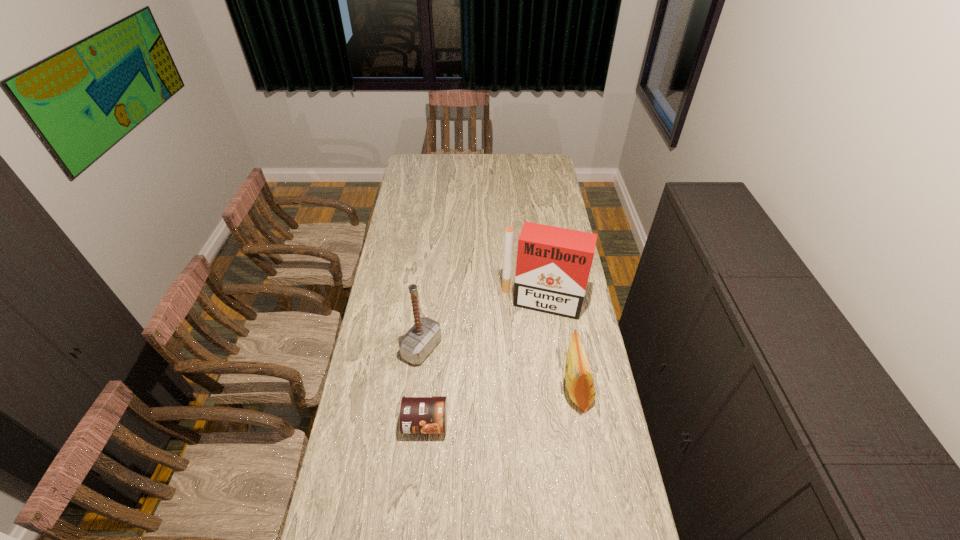
You are a GUI agent. You are given a task and a screenshot of the screen. Output one action in this format:
    pyautogui.click(x=<x>, y=<y>)
    Task: Click on the vacant space that satisfies the following two spatial constraints: 1. on the back side of the hammer; 2. on the right side of the cigarette case
    
    Given the screenshot: What is the action you would take?
    (427, 303)